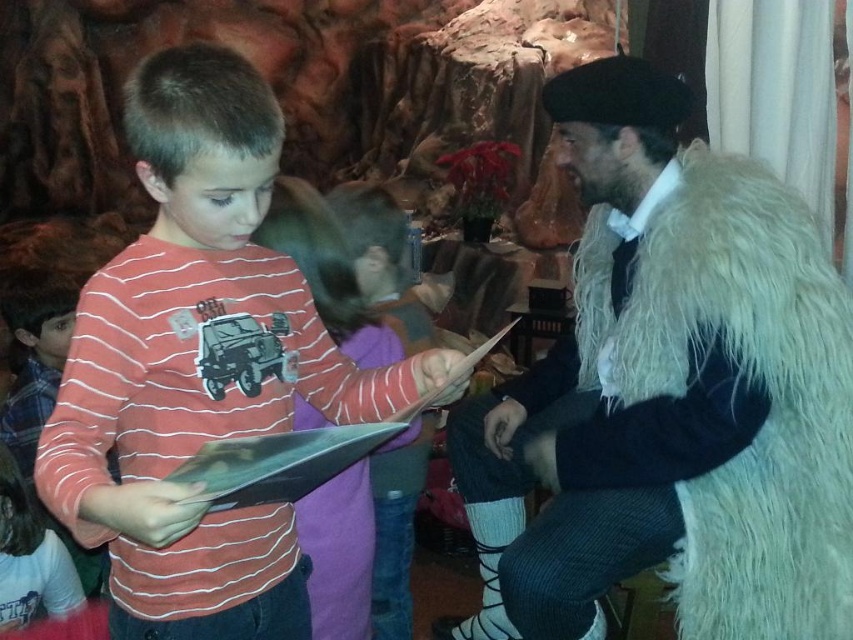
Is striped cotton shirt at center further to the viewer compared to white fluffy fur coat at right?

No, striped cotton shirt at center is in front of white fluffy fur coat at right.

Is point (247, 188) farther from camera compared to point (718, 211)?

No, it is in front of (718, 211).

Does point (83, 406) come farther from viewer compared to point (817, 324)?

No, (83, 406) is closer to viewer.

At what (x,y) coordinates should I click in order to perform the action: click on striped cotton shirt at center. Please return your answer as a coordinate pair (x, y). This screenshot has height=640, width=853. Looking at the image, I should click on (199, 365).